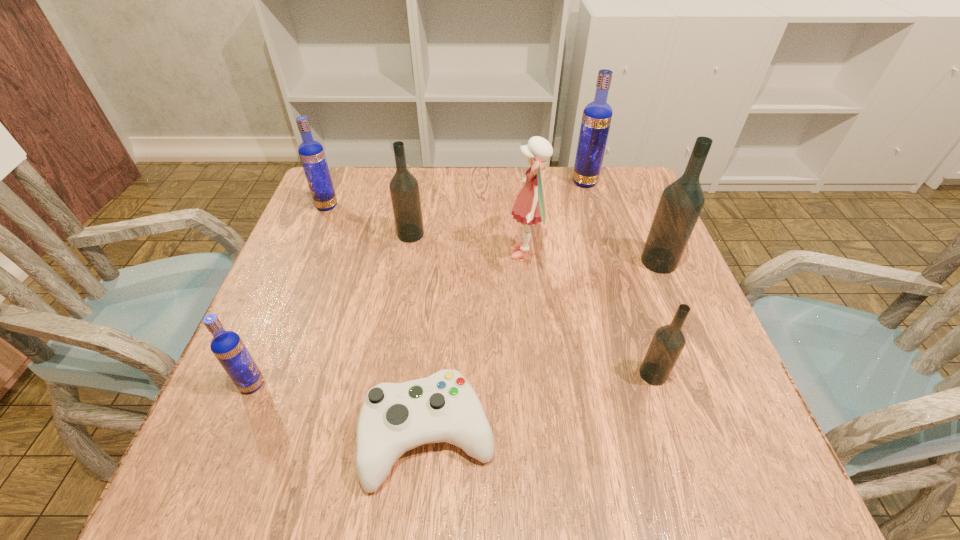
This screenshot has width=960, height=540. Identify the location of black vodka that stands as the closest to the farthest black vodka. (681, 202).

The width and height of the screenshot is (960, 540). I want to click on black vodka that stands as the closest to the third vodka from left to right, so click(x=681, y=202).

Where is `free space that satisfies the following two spatial constraints: 1. on the front side of the smallest blue vodka; 2. on the left side of the white control`? free space that satisfies the following two spatial constraints: 1. on the front side of the smallest blue vodka; 2. on the left side of the white control is located at coordinates (231, 436).